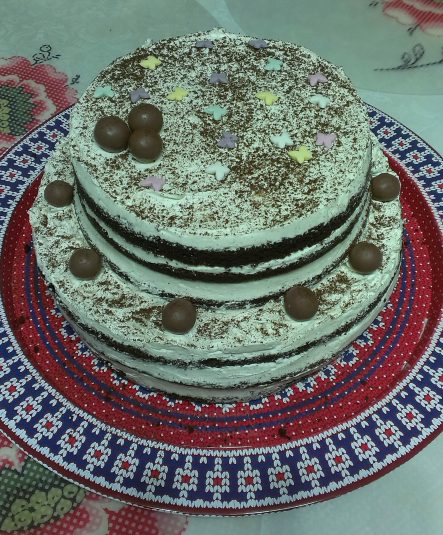
Where is `plate`? The width and height of the screenshot is (443, 535). plate is located at coordinates (249, 455).